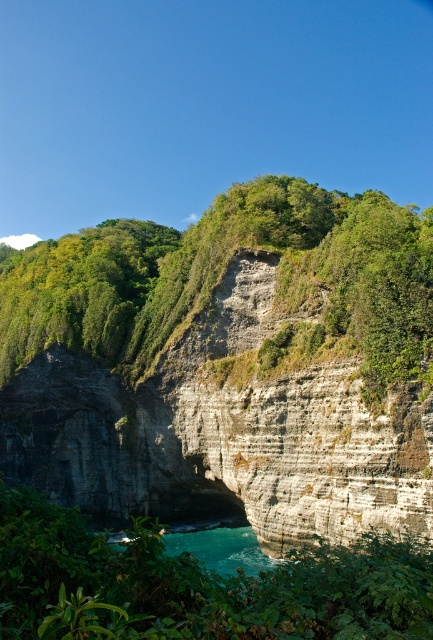
Question: Among these points, which one is farthest from the camera?

Choices:
 (A) (365, 554)
 (B) (307, 230)

Answer: (B)

Question: Is green leafy vegetation at lower center thinner than turquoise glossy water at lower center?

Choices:
 (A) yes
 (B) no

Answer: (B)

Question: Which point is farther from the camera taking this photo?

Choices:
 (A) (223, 547)
 (B) (203, 592)
 (C) (135, 330)

Answer: (C)

Question: Does green leafy vegetation at lower center appear on the right side of turquoise glossy water at lower center?

Choices:
 (A) no
 (B) yes

Answer: (B)

Question: Estimate the real-world distances between objects in this image. Which object is closer to the green leafy vegetation at lower center?

Choices:
 (A) green leafy vegetation at center
 (B) turquoise glossy water at lower center

Answer: (B)

Question: Is green leafy vegetation at lower center positioned before turquoise glossy water at lower center?

Choices:
 (A) yes
 (B) no

Answer: (A)